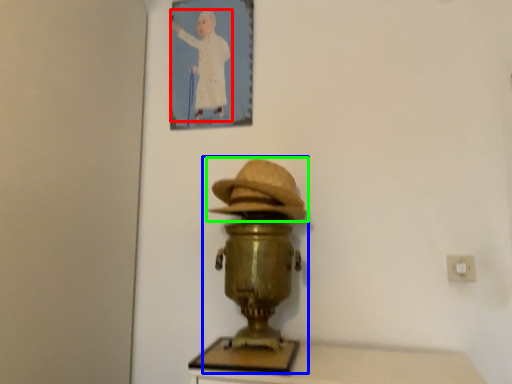
Question: Considering the real-world distances, which object is farthest from person (highlighted by a red box)? table lamp (highlighted by a blue box) or hat (highlighted by a green box)?

Choices:
 (A) table lamp
 (B) hat

Answer: (A)